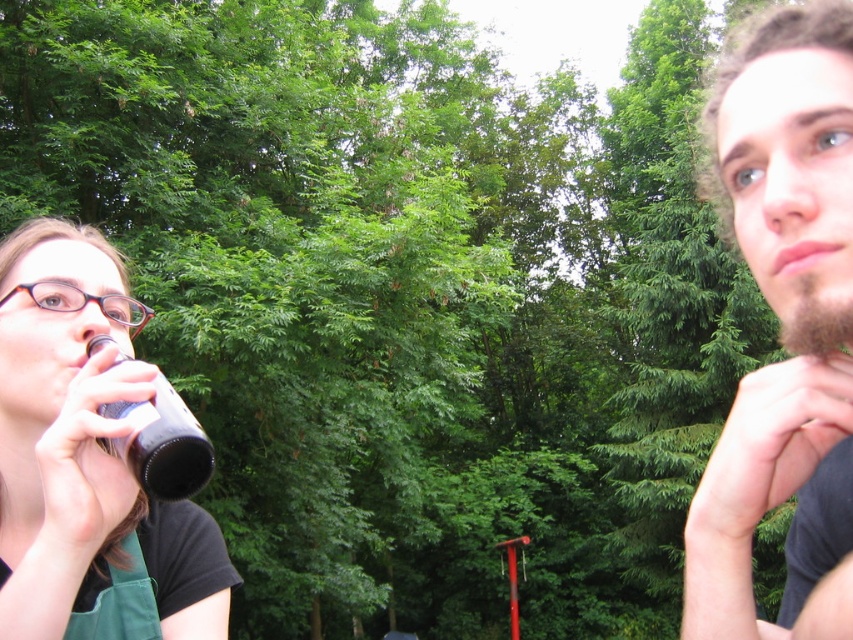
Does matte black bottle at left have a smaller size compared to black matte bottle at left?

No, matte black bottle at left is not smaller than black matte bottle at left.

Can you confirm if matte black bottle at left is wider than black matte bottle at left?

Indeed, matte black bottle at left has a greater width compared to black matte bottle at left.

Who is more forward, (125, 548) or (202, 429)?

Point (125, 548) is in front.

You are a GUI agent. You are given a task and a screenshot of the screen. Output one action in this format:
    pyautogui.click(x=<x>, y=<y>)
    Task: Click on the matte black bottle at left
    The width and height of the screenshot is (853, 640).
    Given the screenshot: What is the action you would take?
    click(x=86, y=460)

Is dark brown beard at right to the right of black matte bottle at left from the viewer's perspective?

Correct, you'll find dark brown beard at right to the right of black matte bottle at left.

Who is taller, dark brown beard at right or black matte bottle at left?

Standing taller between the two is dark brown beard at right.

Measure the distance between dark brown beard at right and camera.

dark brown beard at right is 21.58 inches away from camera.

Locate an element on the screen. This screenshot has width=853, height=640. dark brown beard at right is located at coordinates (782, 324).

Between dark brown beard at right and matte black bottle at left, which one appears on the left side from the viewer's perspective?

From the viewer's perspective, matte black bottle at left appears more on the left side.

Can you confirm if dark brown beard at right is positioned below matte black bottle at left?

Actually, dark brown beard at right is above matte black bottle at left.

I want to click on dark brown beard at right, so click(782, 324).